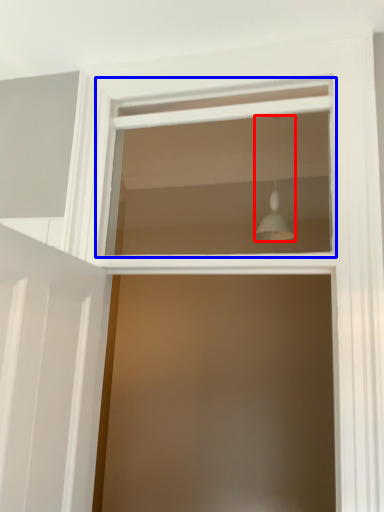
Question: Which object is further to the camera taking this photo, light fixture (highlighted by a red box) or window (highlighted by a blue box)?

Choices:
 (A) light fixture
 (B) window

Answer: (A)